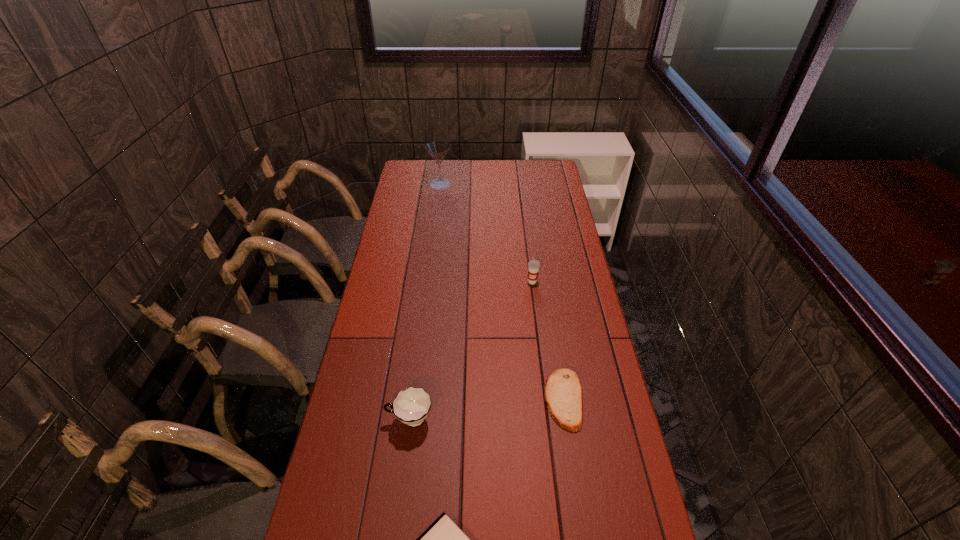
At what (x,y) coordinates should I click in order to perform the action: click on vacant position in the image that satisfies the following two spatial constraints: 1. on the side of the shorter cup with the handle; 2. on the right side of the fourth tallest object. Please return your answer as a coordinate pair (x, y). The image size is (960, 540). Looking at the image, I should click on (413, 399).

Find the location of a particular element. Image resolution: width=960 pixels, height=540 pixels. free space that satisfies the following two spatial constraints: 1. on the side of the third tallest object with the handle; 2. on the right side of the pita bread is located at coordinates (413, 399).

The height and width of the screenshot is (540, 960). I want to click on free location that satisfies the following two spatial constraints: 1. on the side of the tallest object with the handle; 2. on the right side of the left cup, so click(x=440, y=184).